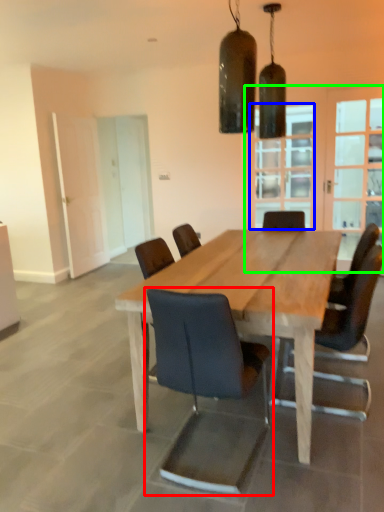
Question: Based on their relative distances, which object is farther from chair (highlighted by a red box)? Choose from window (highlighted by a blue box) and glass door (highlighted by a green box).

Choices:
 (A) window
 (B) glass door

Answer: (A)